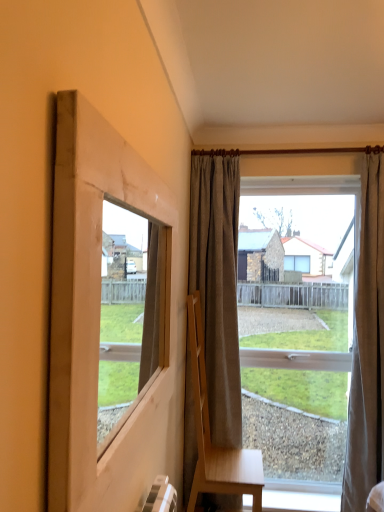
Question: In terms of size, does textured beige curtain at right, which is the 2th curtain from left to right, appear bigger or smaller than light brown wooden chair at center?

Choices:
 (A) big
 (B) small

Answer: (B)

Question: Is textured beige curtain at right, which is the 2th curtain from left to right, in front of or behind light brown wooden chair at center in the image?

Choices:
 (A) behind
 (B) front

Answer: (A)

Question: Which is farther from the gray fabric curtain at center, which appears as the 1th curtain when viewed from the left?

Choices:
 (A) clear glass window at center
 (B) natural wood window frame at left
 (C) textured beige curtain at right, which is the first curtain in right-to-left order
 (D) light brown wooden chair at center

Answer: (B)

Question: Based on their relative distances, which object is nearer to the natural wood window frame at left?

Choices:
 (A) light brown wooden chair at center
 (B) textured beige curtain at right, which is the 2th curtain from left to right
 (C) clear glass window at center
 (D) gray fabric curtain at center, which appears as the 1th curtain when viewed from the left

Answer: (A)